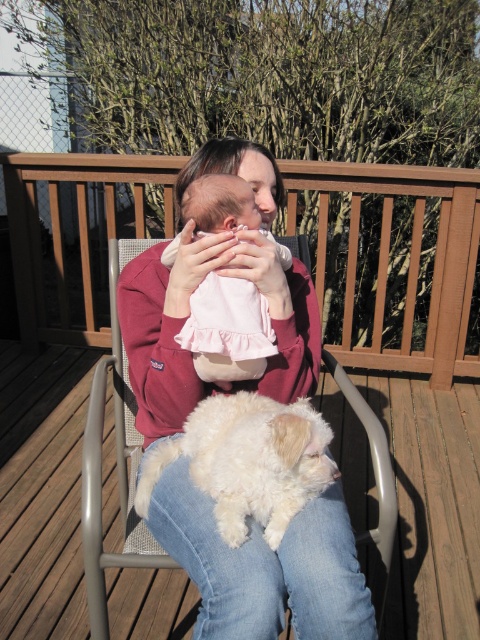
In the scene shown: Between white fluffy dog at center and metallic gray chair at center, which one appears on the left side from the viewer's perspective?

Positioned to the left is metallic gray chair at center.

Does point (191, 472) come closer to viewer compared to point (372, 560)?

That is True.

You are a GUI agent. You are given a task and a screenshot of the screen. Output one action in this format:
    pyautogui.click(x=<x>, y=<y>)
    Task: Click on the white fluffy dog at center
    Image resolution: width=480 pixels, height=640 pixels.
    Given the screenshot: What is the action you would take?
    [248, 461]

Based on the photo, which is below, metallic gray chair at center or pink satin baby at center?

Result: Positioned lower is metallic gray chair at center.

Is point (132, 408) positioned in front of point (205, 192)?

No, it is behind (205, 192).

Locate an element on the screen. metallic gray chair at center is located at coordinates (117, 461).

Is white fluffy dog at center taller than pink satin baby at center?

Incorrect, white fluffy dog at center's height is not larger of pink satin baby at center's.

Can you confirm if white fluffy dog at center is wider than pink satin baby at center?

Indeed, white fluffy dog at center has a greater width compared to pink satin baby at center.

Which is behind, point (324, 449) or point (223, 353)?

Point (223, 353)

At what (x,y) coordinates should I click in order to perform the action: click on white fluffy dog at center. Please return your answer as a coordinate pair (x, y). This screenshot has height=640, width=480. Looking at the image, I should click on (248, 461).